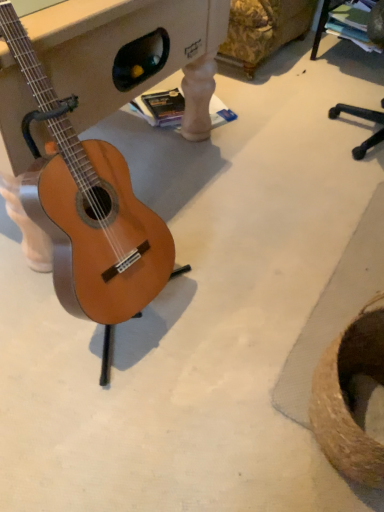
Where is `natural wood guitar at left`? Image resolution: width=384 pixels, height=512 pixels. natural wood guitar at left is located at coordinates (87, 206).

The image size is (384, 512). What do you see at coordinates (87, 206) in the screenshot? I see `natural wood guitar at left` at bounding box center [87, 206].

Measure the distance between natural wood guitar at left and camera.

natural wood guitar at left is 36.05 inches from camera.

The height and width of the screenshot is (512, 384). I want to click on natural wood guitar at left, so click(x=87, y=206).